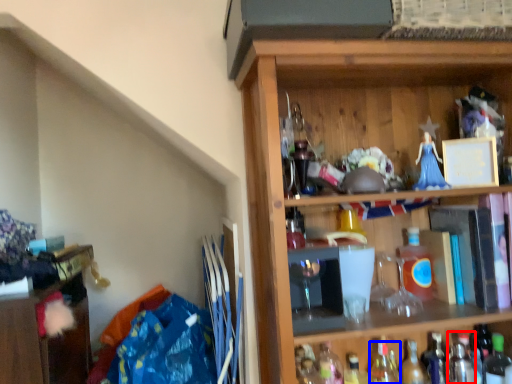
Question: Which object appears farthest to the camera in this image, bottle (highlighted by a red box) or bottle (highlighted by a blue box)?

Choices:
 (A) bottle
 (B) bottle

Answer: (B)